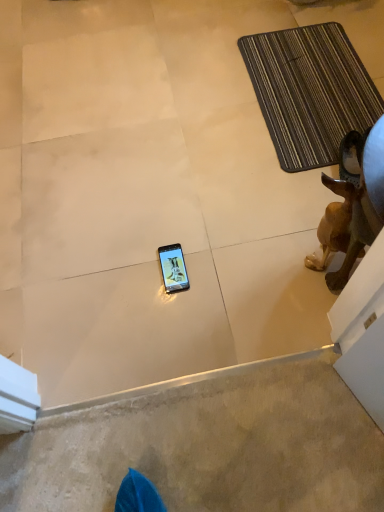
At what (x,y) coordinates should I click in order to perform the action: click on free point to the left of brown matte dog at right. Please return your answer as a coordinate pair (x, y). Looking at the image, I should click on (262, 267).